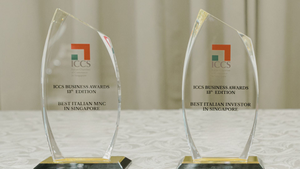
The image size is (300, 169). What are the coordinates of `glass` in the screenshot? It's located at (82, 122).